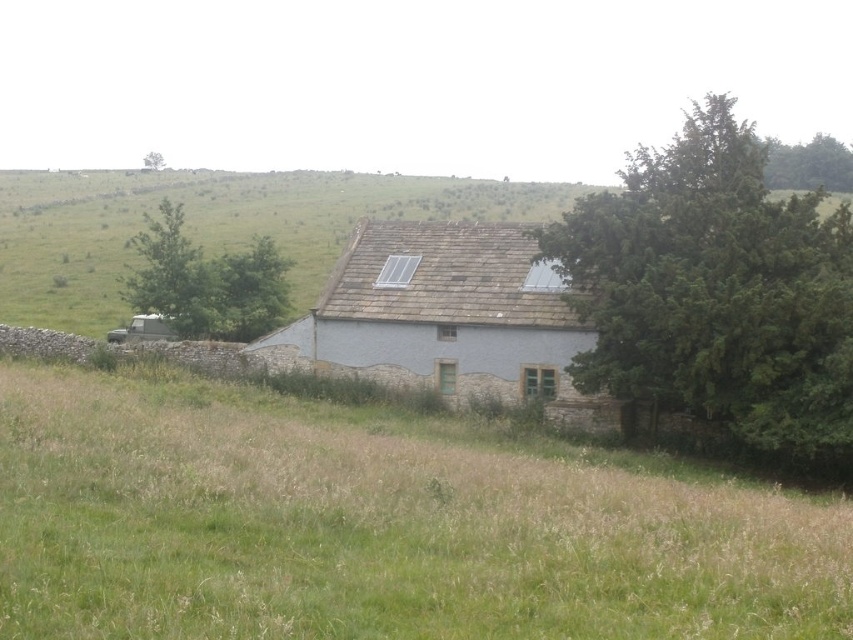
Is green leafy tree at right positioned behind white stone cottage at center?

No, it is in front of white stone cottage at center.

Can you confirm if green leafy tree at right is smaller than white stone cottage at center?

No, green leafy tree at right is not smaller than white stone cottage at center.

Is point (805, 244) closer to camera compared to point (308, 362)?

Yes, it is in front of point (308, 362).

Find the location of a particular element. The height and width of the screenshot is (640, 853). green leafy tree at right is located at coordinates (717, 298).

Is point (796, 634) in front of point (163, 161)?

Yes, it is in front of point (163, 161).

Which is behind, point (244, 604) or point (163, 163)?

The point (163, 163) is more distant.

This screenshot has width=853, height=640. Describe the element at coordinates (374, 528) in the screenshot. I see `green grass at center` at that location.

Locate an element on the screen. The height and width of the screenshot is (640, 853). green grass at center is located at coordinates (374, 528).

Who is lower down, green grass at center or green leafy tree at upper right?

green grass at center is lower down.

Image resolution: width=853 pixels, height=640 pixels. What do you see at coordinates (374, 528) in the screenshot? I see `green grass at center` at bounding box center [374, 528].

This screenshot has width=853, height=640. What are the coordinates of `green grass at center` in the screenshot? It's located at [374, 528].